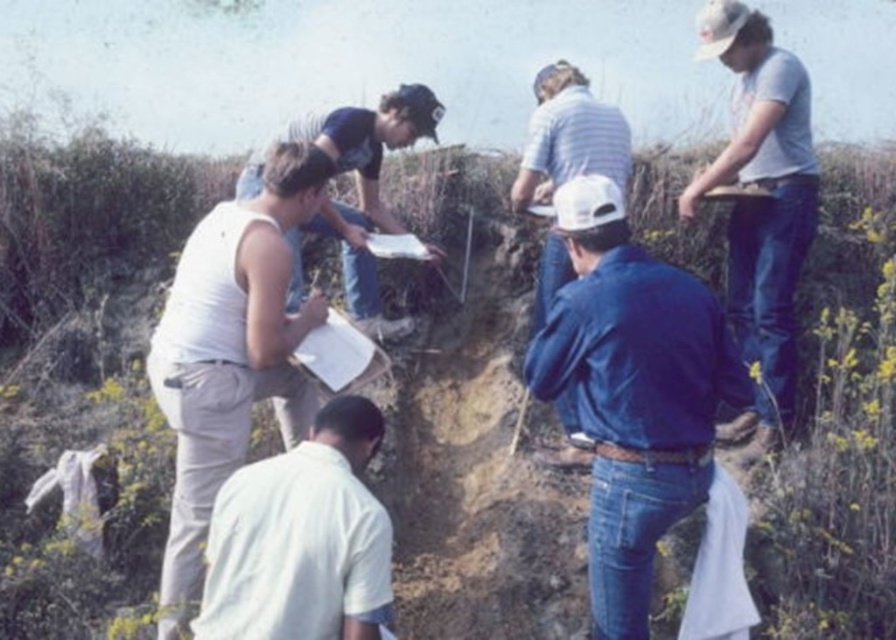
You are an archaeologist looking at the scene. You notice the blue denim jeans at center and the white cotton shirt at lower center. Which clothing item is covering the other?

The blue denim jeans at center is positioned over the white cotton shirt at lower center, so the jeans are covering the shirt.

You are standing at point [378,129] and want to walk to the nearest tree. There is a point [317,490] in front of you. Can you see the tree from your current position?

Since point [317,490] is in front of point [378,129], the tree might be blocked by the point in front. However, the description does not mention any obstacles or trees, so we cannot confirm visibility.

What is the 2D coordinate of the white cotton shirt at lower center?

The 2D coordinate of the white cotton shirt at lower center is at point (300, 540).